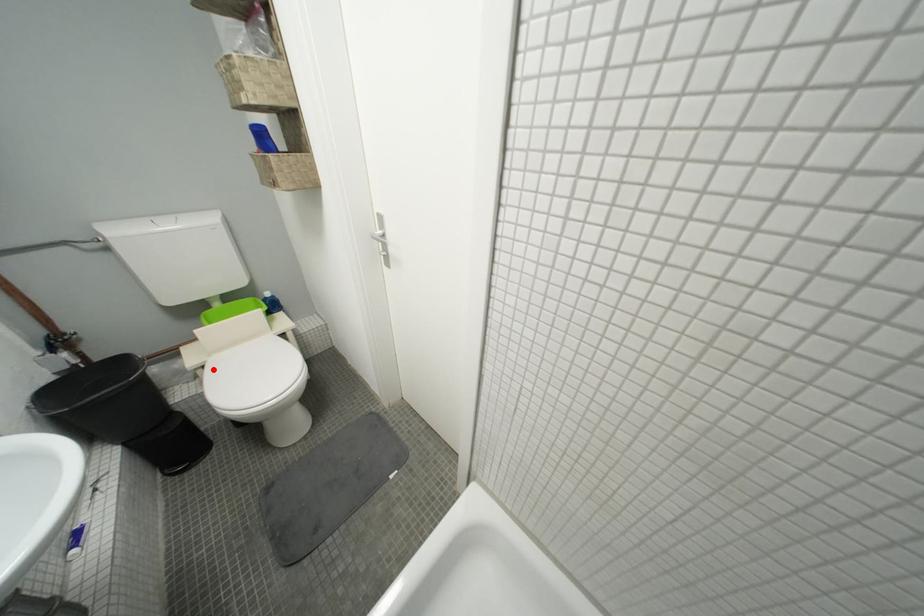
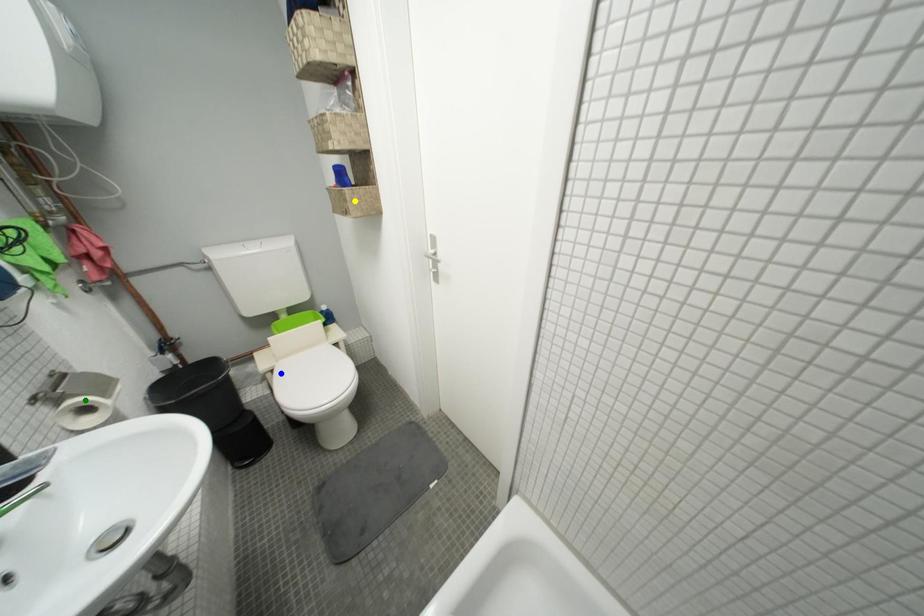
Question: I am providing you with two images of the same scene from different viewpoints. A red point is marked on the first image. You are given multiple points on the second image. Which point in image 2 represents the same 3d spot as the red point in image 1?

Choices:
 (A) yellow point
 (B) blue point
 (C) green point

Answer: (B)